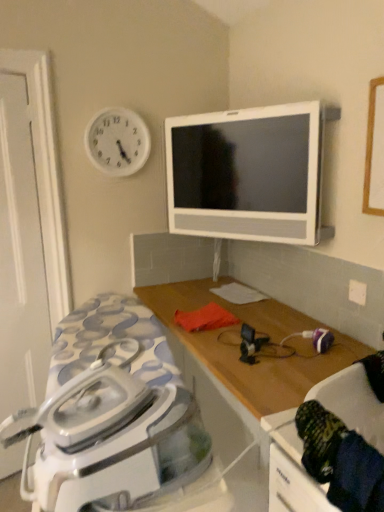
Question: Is white glossy television at upper center situated inside wooden table at center or outside?

Choices:
 (A) inside
 (B) outside

Answer: (B)

Question: From a real-world perspective, is white glossy television at upper center physically located above or below wooden table at center?

Choices:
 (A) below
 (B) above

Answer: (B)

Question: Which object is positioned farthest from the white matte door at left?

Choices:
 (A) white glossy iron at lower left
 (B) white plastic clock at upper left
 (C) dark blue fabric swivel chair at lower right
 (D) white glossy television at upper center
 (E) wooden table at center

Answer: (C)

Question: Which is nearer to the white plastic clock at upper left?

Choices:
 (A) white glossy television at upper center
 (B) wooden table at center
 (C) dark blue fabric swivel chair at lower right
 (D) white glossy iron at lower left
 (E) white matte door at left

Answer: (E)